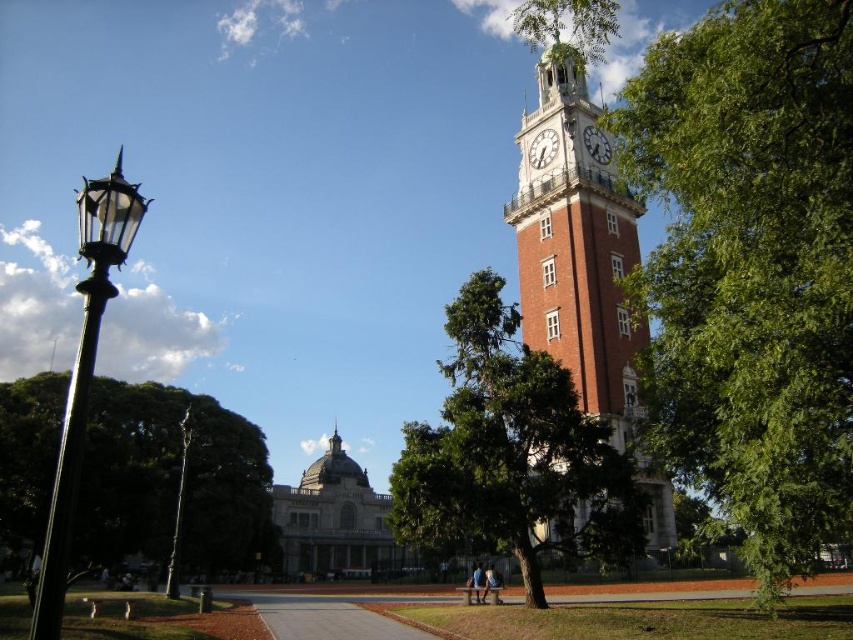
Locate an element on the screen. This screenshot has width=853, height=640. green leafy tree at right is located at coordinates (751, 268).

Is green leafy tree at right to the right of blue denim jeans at lower center from the viewer's perspective?

Correct, you'll find green leafy tree at right to the right of blue denim jeans at lower center.

Does point (634, 173) come closer to viewer compared to point (479, 564)?

Yes, point (634, 173) is in front of point (479, 564).

Locate an element on the screen. This screenshot has width=853, height=640. green leafy tree at right is located at coordinates (751, 268).

Does green leafy tree at center have a greater height compared to white metallic clock at upper right?

Yes, green leafy tree at center is taller than white metallic clock at upper right.

What do you see at coordinates (512, 454) in the screenshot?
I see `green leafy tree at center` at bounding box center [512, 454].

Locate an element on the screen. This screenshot has width=853, height=640. green leafy tree at center is located at coordinates (512, 454).

Can you confirm if polished brass lamp post at left is thinner than white painted metal clock at upper right?

In fact, polished brass lamp post at left might be wider than white painted metal clock at upper right.

Does point (165, 592) come in front of point (532, 166)?

No.

Where is `polished brass lamp post at left`? This screenshot has height=640, width=853. polished brass lamp post at left is located at coordinates (178, 508).